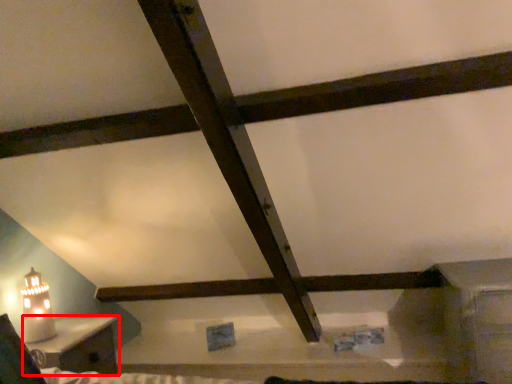
Question: In this image, where is furniture (annotated by the red box) located relative to table lamp?

Choices:
 (A) left
 (B) right

Answer: (B)